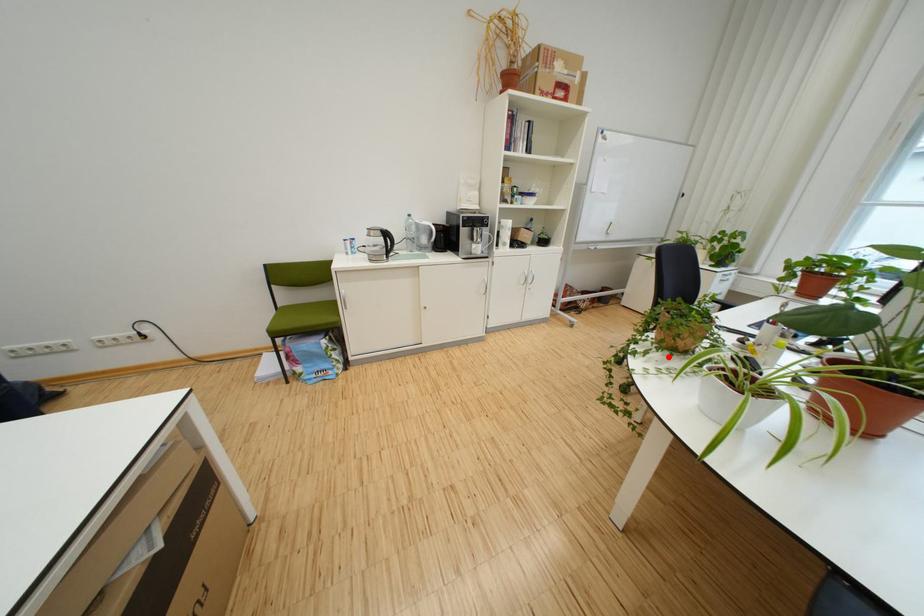
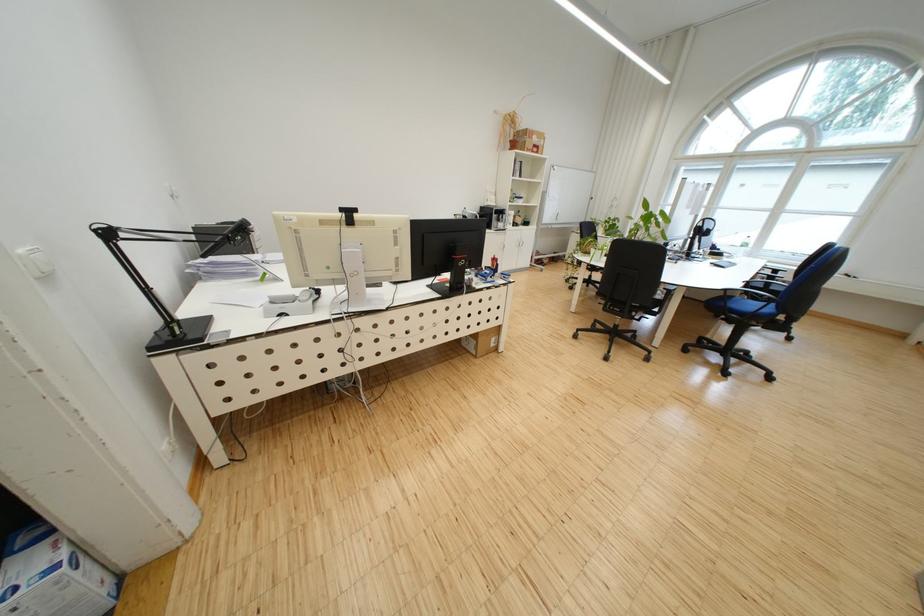
Where in the second image is the point corresponding to the highlighted location from the first image?

(592, 256)